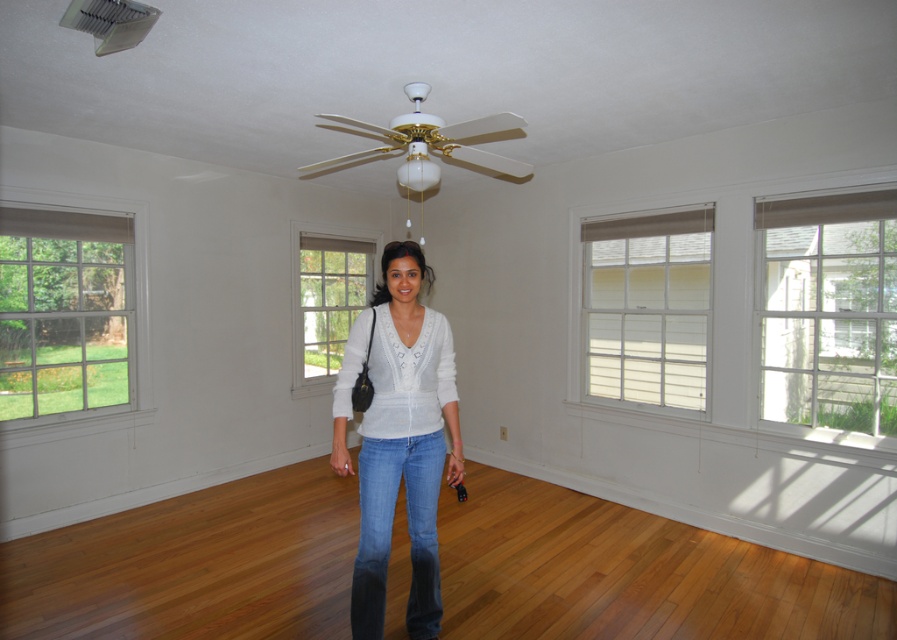
Question: Which point is closer to the camera?

Choices:
 (A) (410, 445)
 (B) (420, 564)

Answer: (A)

Question: Does denim at center have a lesser width compared to white glossy ceiling fan at upper center?

Choices:
 (A) no
 (B) yes

Answer: (B)

Question: Does white knit sweater at center appear on the left side of white glossy ceiling fan at upper center?

Choices:
 (A) yes
 (B) no

Answer: (B)

Question: Can you confirm if white knit sweater at center is smaller than white glossy ceiling fan at upper center?

Choices:
 (A) yes
 (B) no

Answer: (A)

Question: Which object is farther from the camera taking this photo?

Choices:
 (A) white knit sweater at center
 (B) white glossy ceiling fan at upper center

Answer: (B)

Question: Which point appears closest to the camera in this image?

Choices:
 (A) (388, 253)
 (B) (379, 518)

Answer: (A)